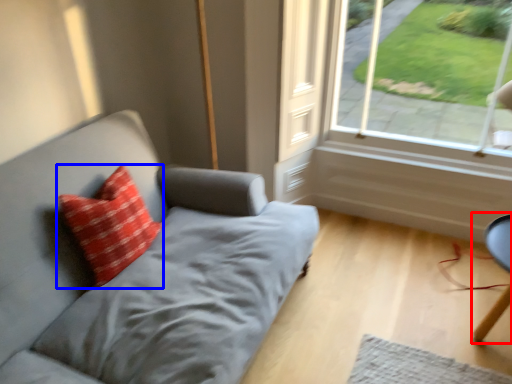
Question: Which point is closer to the camera, computer chair (highlighted by a red box) or pillow (highlighted by a blue box)?

Choices:
 (A) computer chair
 (B) pillow

Answer: (B)